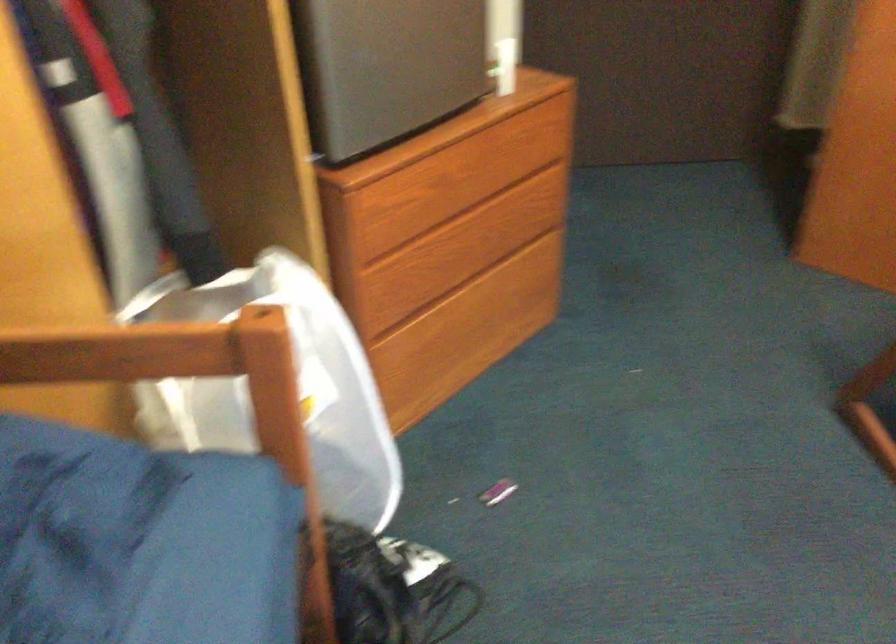
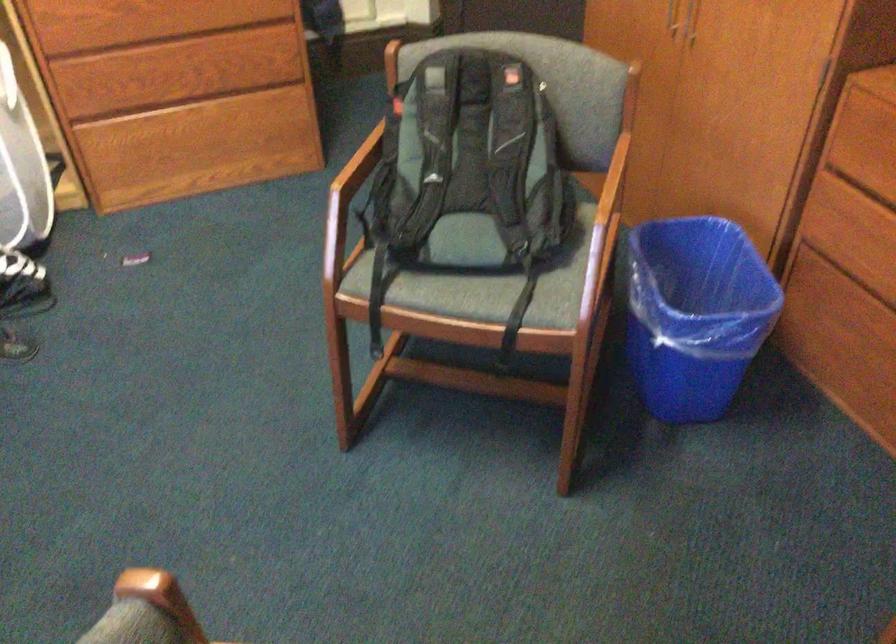
The point at (460, 182) is marked in the first image. Where is the corresponding point in the second image?

(160, 20)